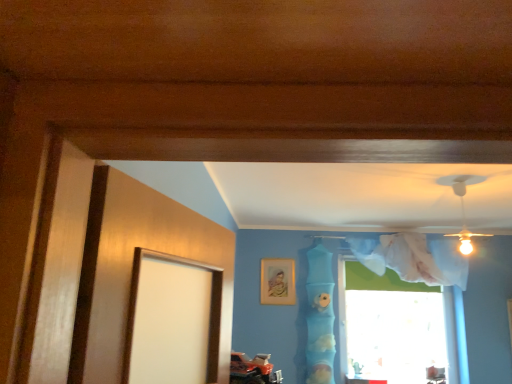
Question: Relative to blue fabric at center, is transparent fabric at upper right in front or behind?

Choices:
 (A) behind
 (B) front

Answer: (A)

Question: Is transparent fabric at upper right inside or outside of blue fabric at center?

Choices:
 (A) outside
 (B) inside

Answer: (A)

Question: Which object is positioned farthest from the blue fabric at center?

Choices:
 (A) transparent fabric at upper right
 (B) gold metallic picture frame at upper center

Answer: (A)

Question: Which of these objects is positioned farthest from the gold metallic picture frame at upper center?

Choices:
 (A) blue fabric at center
 (B) transparent fabric at upper right

Answer: (B)